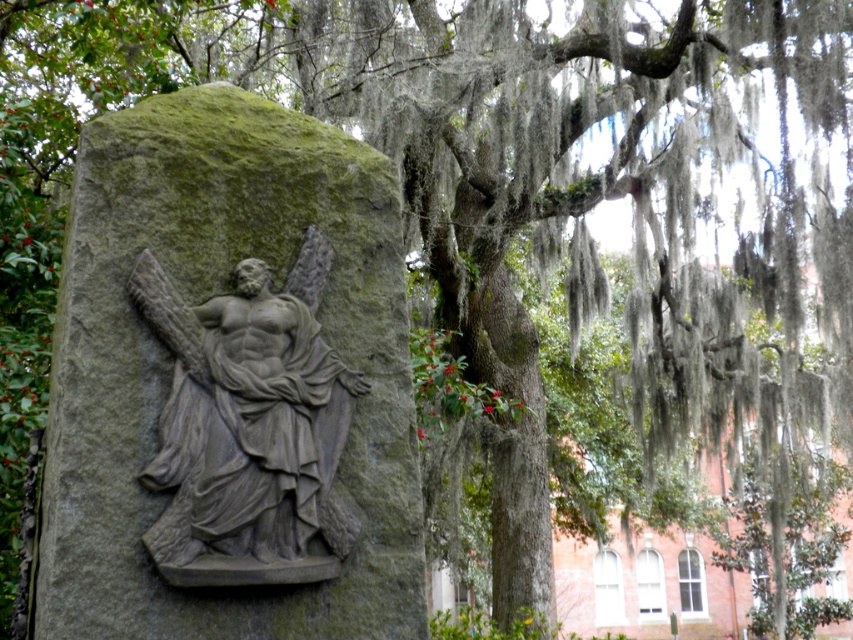
You are an artist planning to create a miniature model of the scene. You have a limited workspace and need to know which object is wider. Which is wider between the gray stone carving at center and the gray stone sculpture at center?

The gray stone carving at center is wider than the gray stone sculpture at center according to the description.

You are an art student analyzing the outdoor scene. You notice two objects labeled gray stone carving at center and gray stone sculpture at center. Which one is bigger?

The gray stone carving at center is larger in size than the gray stone sculpture at center.

You are an art student visiting a historical site and see the gray stone carving at center and the gray stone sculpture at center. Which one is positioned more to the left?

The gray stone carving at center is positioned more to the left than the gray stone sculpture at center.